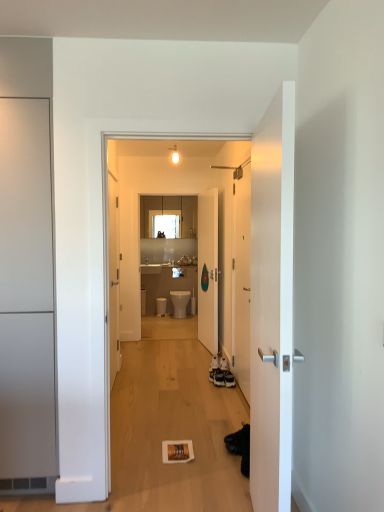
Question: In terms of height, does white glossy door at center, the 4th door positioned from the left, look taller or shorter compared to matte wood cabinets at upper center?

Choices:
 (A) short
 (B) tall

Answer: (B)

Question: Considering their positions, is white glossy door at center, positioned as the first door in right-to-left order, located in front of or behind matte wood cabinets at upper center?

Choices:
 (A) behind
 (B) front

Answer: (B)

Question: Based on their relative distances, which object is farther from the white glossy toilet at center?

Choices:
 (A) matte wood cabinets at upper center
 (B) white glossy door at center, the 2th door positioned from the back
 (C) white matte door at left, which appears as the 3th door when viewed from the back
 (D) white glossy door at right, acting as the 4th door starting from the back
 (E) white glossy sink at center

Answer: (D)

Question: Considering the real-world distances, which object is farthest from the matte wood cabinets at upper center?

Choices:
 (A) white glossy door at center, which is counted as the second door, starting from the left
 (B) white matte door at left, which appears as the 3th door when viewed from the back
 (C) white glossy door at right, marked as the 2th door in a right-to-left arrangement
 (D) white glossy sink at center
 (E) white glossy toilet at center

Answer: (C)